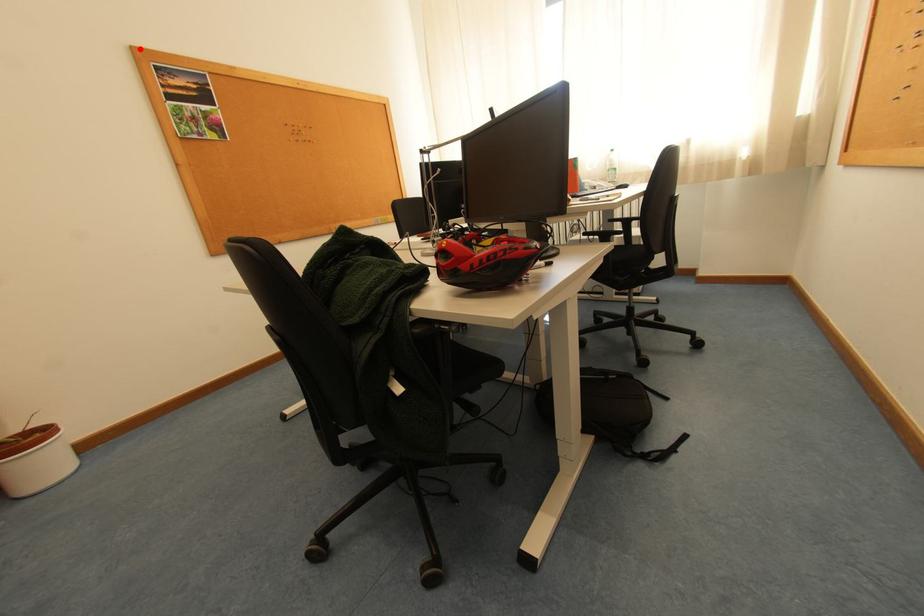
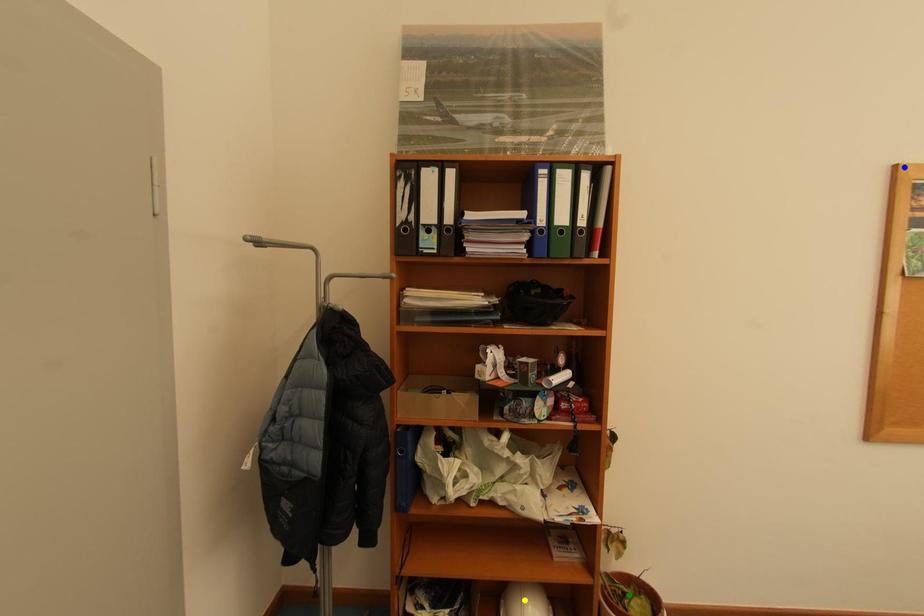
Question: I am providing you with two images of the same scene from different viewpoints. A red point is marked on the first image. You are given multiple points on the second image. Which spot in image 2 lines up with the point in image 1?

Choices:
 (A) blue point
 (B) yellow point
 (C) green point

Answer: (A)